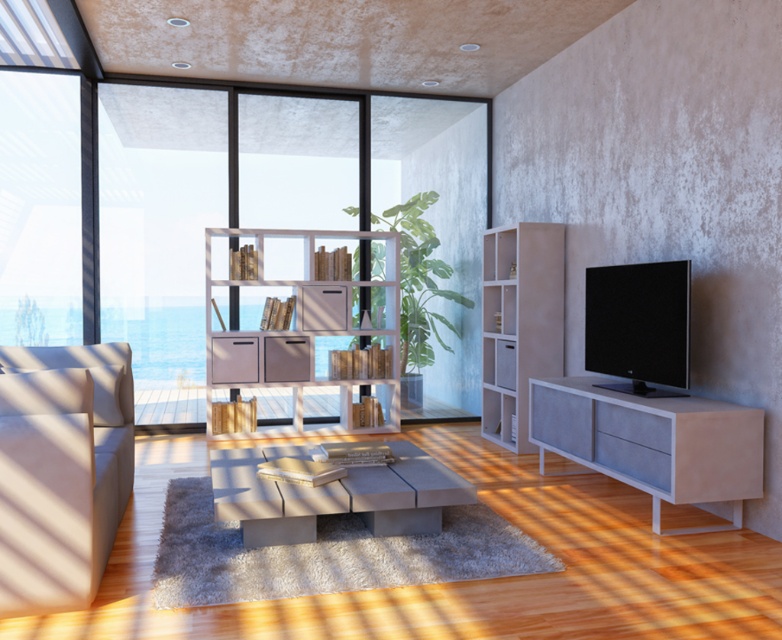
Does beige fabric couch at left appear on the left side of white textured bookshelf at center?

Indeed, beige fabric couch at left is positioned on the left side of white textured bookshelf at center.

Is point (84, 557) in front of point (508, 269)?

Yes, it is.

I want to click on beige fabric couch at left, so click(x=61, y=470).

Does point (149, 168) come behind point (257, 481)?

Yes.

Describe the element at coordinates (160, 236) in the screenshot. I see `transparent glass window at left` at that location.

Find the location of a particular element. The width and height of the screenshot is (782, 640). transparent glass window at left is located at coordinates (160, 236).

Based on the photo, who is more forward, (16, 540) or (745, 406)?

Point (16, 540) is more forward.

Is point (74, 536) more distant than point (598, 422)?

No, (74, 536) is closer to viewer.

Is point (2, 401) farther from camera compared to point (757, 408)?

No, (2, 401) is closer to viewer.

You are a GUI agent. You are given a task and a screenshot of the screen. Output one action in this format:
    pyautogui.click(x=<x>, y=<y>)
    Task: Click on the beige fabric couch at left
    
    Given the screenshot: What is the action you would take?
    pyautogui.click(x=61, y=470)